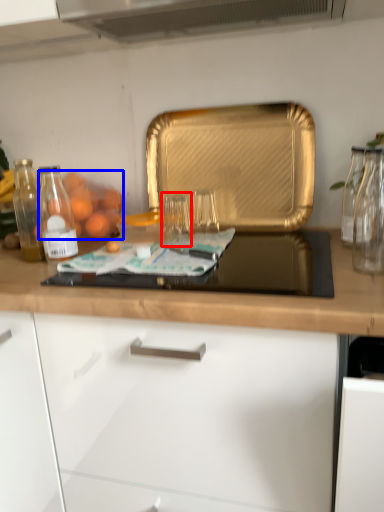
Question: Which object appears closest to the camera in this image, glass jar (highlighted by a red box) or fruit (highlighted by a blue box)?

Choices:
 (A) glass jar
 (B) fruit

Answer: (A)